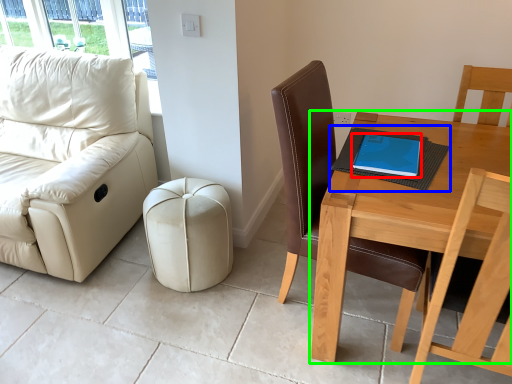
Question: Which is nearer to the tablet computer (highlighted by a red box)? notebook (highlighted by a blue box) or table (highlighted by a green box).

Choices:
 (A) notebook
 (B) table

Answer: (A)